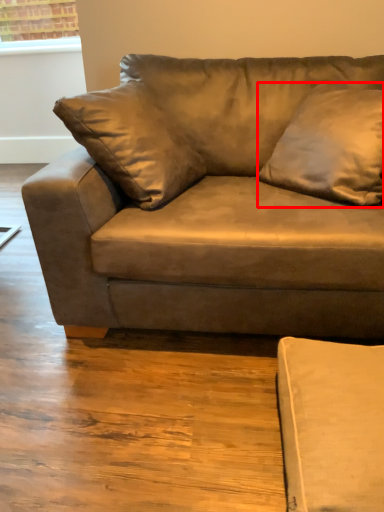
Question: From the image's perspective, considering the relative positions of pillow (annotated by the red box) and studio couch in the image provided, where is pillow (annotated by the red box) located with respect to the staircase?

Choices:
 (A) above
 (B) below

Answer: (A)